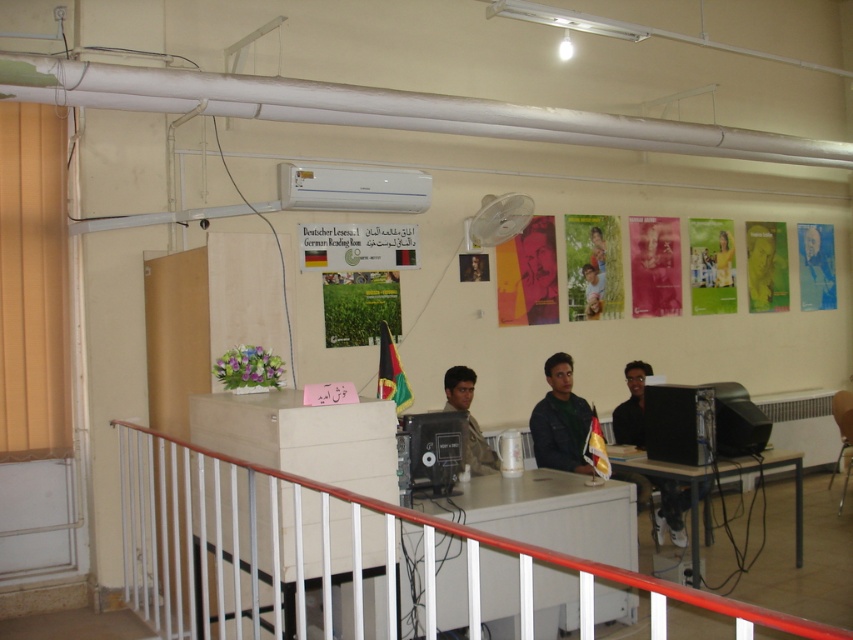
You are standing at the desk and notice two items, the dark brown leather jacket at center and the blue fabric shirt at center. Which one is located to the left?

The dark brown leather jacket at center is positioned on the left side of the blue fabric shirt at center, so it is located to the left.

You are standing at the entrance of the library and want to find the yellow fabric shirt at center. Which side of the white plastic table at lower center should you look towards to locate it?

The yellow fabric shirt at center is on the right side of the white plastic table at lower center, so you should look towards the right side of the white plastic table at lower center to locate it.

Consider the image. You are standing at the desk and want to reach the blue fabric shirt at center. Is the dark green leather jacket at center blocking your direct path to it?

Yes, the dark green leather jacket at center is blocking the path to the blue fabric shirt at center because it is positioned in front of it.